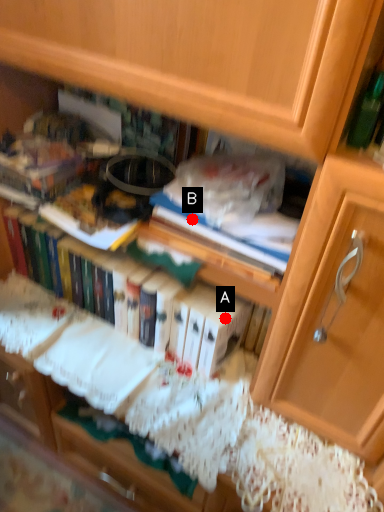
Question: Two points are circled on the image, labeled by A and B beside each circle. Among these points, which one is farthest from the camera?

Choices:
 (A) A is further
 (B) B is further

Answer: (A)